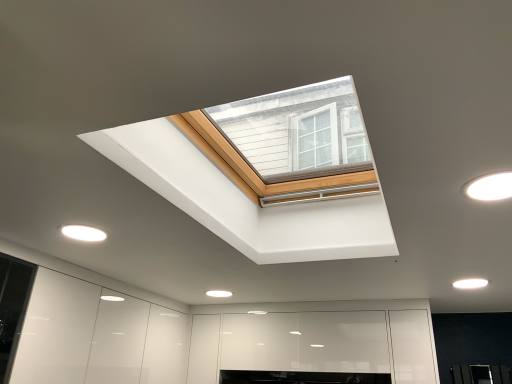
This screenshot has width=512, height=384. What do you see at coordinates (83, 233) in the screenshot? I see `white glossy light fixture at lower left, the 1th lighting when ordered from left to right` at bounding box center [83, 233].

You are a GUI agent. You are given a task and a screenshot of the screen. Output one action in this format:
    pyautogui.click(x=<x>, y=<y>)
    Task: Click on the white matte light fixture at lower right, which ranks as the third lighting in front-to-back order
    
    Given the screenshot: What is the action you would take?
    click(x=470, y=283)

How different are the orientations of white matte light fixture at lower right, arranged as the third lighting when viewed from the left, and white matte light fixture at upper right, which appears as the 3th lighting when viewed from the back, in degrees?

0.000475 degrees separate the facing orientations of white matte light fixture at lower right, arranged as the third lighting when viewed from the left, and white matte light fixture at upper right, which appears as the 3th lighting when viewed from the back.

Are white matte light fixture at lower right, arranged as the third lighting when viewed from the left, and white matte light fixture at upper right, which ranks as the first lighting in front-to-back order, making contact?

There is a gap between white matte light fixture at lower right, arranged as the third lighting when viewed from the left, and white matte light fixture at upper right, which ranks as the first lighting in front-to-back order.

Relative to white matte light fixture at upper right, which ranks as the 3th lighting in bottom-to-top order, is white matte light fixture at lower right, which ranks as the 3th lighting in top-to-bottom order, in front or behind?

white matte light fixture at lower right, which ranks as the 3th lighting in top-to-bottom order, is behind white matte light fixture at upper right, which ranks as the 3th lighting in bottom-to-top order.

In terms of size, does white matte light fixture at lower right, which ranks as the 3th lighting in top-to-bottom order, appear bigger or smaller than white matte light fixture at upper right, the 1th lighting positioned from the top?

In the image, white matte light fixture at lower right, which ranks as the 3th lighting in top-to-bottom order, appears to be smaller than white matte light fixture at upper right, the 1th lighting positioned from the top.

From the image's perspective, which one is positioned higher, white glossy light fixture at lower left, placed as the second lighting when sorted from front to back, or white matte light fixture at upper right, which is the 2th lighting in left-to-right order?

white matte light fixture at upper right, which is the 2th lighting in left-to-right order, appears higher in the image.

Starting from the white glossy light fixture at lower left, positioned as the 3th lighting in right-to-left order, which lighting is the 1st one to the right? Please provide its 2D coordinates.

[(490, 187)]

Based on their positions, is white glossy light fixture at lower left, placed as the second lighting when sorted from front to back, located to the left or right of white matte light fixture at upper right, which appears as the 3th lighting when viewed from the back?

In the image, white glossy light fixture at lower left, placed as the second lighting when sorted from front to back, appears on the left side of white matte light fixture at upper right, which appears as the 3th lighting when viewed from the back.

Is white glossy light fixture at lower left, the 1th lighting when ordered from left to right, beside white matte light fixture at upper right, positioned as the second lighting in right-to-left order?

No, white glossy light fixture at lower left, the 1th lighting when ordered from left to right, is not touching white matte light fixture at upper right, positioned as the second lighting in right-to-left order.

What's the angular difference between white glossy light fixture at lower left, the second lighting positioned from the top, and white matte light fixture at lower right, the 1th lighting when ordered from back to front,'s facing directions?

They differ by 0.000472 degrees in their facing directions.

Which of these two, white glossy light fixture at lower left, the 1th lighting when ordered from left to right, or white matte light fixture at lower right, the first lighting in the bottom-to-top sequence, is thinner?

white matte light fixture at lower right, the first lighting in the bottom-to-top sequence.

From the white glossy light fixture at lower left, marked as the 2th lighting in a back-to-front arrangement, count 2nd lighting to the right and point to it. Please provide its 2D coordinates.

[(470, 283)]

From a real-world perspective, which object rests below the other?

From a 3D spatial view, white glossy light fixture at lower left, positioned as the 3th lighting in right-to-left order, is below.

From the picture: How different are the orientations of white matte light fixture at lower right, which ranks as the 3th lighting in top-to-bottom order, and white glossy light fixture at lower left, arranged as the 2th lighting when ordered from the bottom, in degrees?

0.000472 degrees separate the facing orientations of white matte light fixture at lower right, which ranks as the 3th lighting in top-to-bottom order, and white glossy light fixture at lower left, arranged as the 2th lighting when ordered from the bottom.

Is white matte light fixture at lower right, arranged as the third lighting when viewed from the left, not within white glossy light fixture at lower left, marked as the 2th lighting in a back-to-front arrangement?

Yes, white matte light fixture at lower right, arranged as the third lighting when viewed from the left, is located beyond the bounds of white glossy light fixture at lower left, marked as the 2th lighting in a back-to-front arrangement.

Where is `lighting that is the 1st object located above the white matte light fixture at lower right, which appears as the first lighting when viewed from the right (from the image's perspective)`? This screenshot has width=512, height=384. lighting that is the 1st object located above the white matte light fixture at lower right, which appears as the first lighting when viewed from the right (from the image's perspective) is located at coordinates click(x=83, y=233).

Between white matte light fixture at lower right, the 1th lighting when ordered from back to front, and white glossy light fixture at lower left, marked as the 2th lighting in a back-to-front arrangement, which one has smaller width?

Thinner between the two is white matte light fixture at lower right, the 1th lighting when ordered from back to front.

Between white matte light fixture at upper right, which ranks as the 3th lighting in bottom-to-top order, and white matte light fixture at lower right, which appears as the first lighting when viewed from the right, which one has smaller width?

Thinner between the two is white matte light fixture at lower right, which appears as the first lighting when viewed from the right.

Which lighting is the 1st one when counting from the left side of the white matte light fixture at lower right, arranged as the third lighting when viewed from the left? Please provide its 2D coordinates.

[(490, 187)]

From the image's perspective, is white matte light fixture at upper right, the 1th lighting positioned from the top, under white matte light fixture at lower right, which ranks as the third lighting in front-to-back order?

No.

The image size is (512, 384). There is a white matte light fixture at upper right, which appears as the 3th lighting when viewed from the back. What are the coordinates of `the 1st lighting below it (from the image's perspective)` in the screenshot? It's located at (83, 233).

From the image's perspective, which is above, white matte light fixture at upper right, which ranks as the 3th lighting in bottom-to-top order, or white glossy light fixture at lower left, arranged as the 2th lighting when ordered from the bottom?

white matte light fixture at upper right, which ranks as the 3th lighting in bottom-to-top order, from the image's perspective.

This screenshot has width=512, height=384. Identify the location of the 1st lighting directly beneath the white matte light fixture at upper right, the 1th lighting positioned from the top (from a real-world perspective). (470, 283).

From the image's perspective, count 1st lightings downward from the white matte light fixture at upper right, positioned as the second lighting in right-to-left order, and point to it. Please provide its 2D coordinates.

[(83, 233)]

Looking at the image, which one is located closer to white glossy light fixture at lower left, the 1th lighting when ordered from left to right, white matte light fixture at lower right, arranged as the third lighting when viewed from the left, or white matte light fixture at upper right, which is the 2th lighting in left-to-right order?

white matte light fixture at upper right, which is the 2th lighting in left-to-right order.

Which object lies nearer to the anchor point white matte light fixture at upper right, which ranks as the 3th lighting in bottom-to-top order, white glossy light fixture at lower left, placed as the second lighting when sorted from front to back, or white matte light fixture at lower right, which appears as the first lighting when viewed from the right?

Among the two, white matte light fixture at lower right, which appears as the first lighting when viewed from the right, is located nearer to white matte light fixture at upper right, which ranks as the 3th lighting in bottom-to-top order.

Based on the photo, when comparing their distances from white matte light fixture at lower right, which ranks as the 3th lighting in top-to-bottom order, does white matte light fixture at upper right, which ranks as the 3th lighting in bottom-to-top order, or white glossy light fixture at lower left, marked as the 2th lighting in a back-to-front arrangement, seem further?

Based on the image, white glossy light fixture at lower left, marked as the 2th lighting in a back-to-front arrangement, appears to be further to white matte light fixture at lower right, which ranks as the 3th lighting in top-to-bottom order.

From the image, which object appears to be farther from white matte light fixture at upper right, positioned as the second lighting in right-to-left order, white matte light fixture at lower right, the 1th lighting when ordered from back to front, or white glossy light fixture at lower left, placed as the second lighting when sorted from front to back?

The object further to white matte light fixture at upper right, positioned as the second lighting in right-to-left order, is white glossy light fixture at lower left, placed as the second lighting when sorted from front to back.

Estimate the real-world distances between objects in this image. Which object is further from white glossy light fixture at lower left, positioned as the 3th lighting in right-to-left order, white matte light fixture at upper right, the 1th lighting positioned from the top, or white matte light fixture at lower right, which ranks as the third lighting in front-to-back order?

Based on the image, white matte light fixture at lower right, which ranks as the third lighting in front-to-back order, appears to be further to white glossy light fixture at lower left, positioned as the 3th lighting in right-to-left order.

When comparing their distances from white matte light fixture at lower right, the 1th lighting when ordered from back to front, does white glossy light fixture at lower left, arranged as the 2th lighting when ordered from the bottom, or white matte light fixture at upper right, which is the 2th lighting in left-to-right order, seem further?

white glossy light fixture at lower left, arranged as the 2th lighting when ordered from the bottom, is positioned further to the anchor white matte light fixture at lower right, the 1th lighting when ordered from back to front.

Find the location of `lighting located between white glossy light fixture at lower left, positioned as the 3th lighting in right-to-left order, and white matte light fixture at lower right, which ranks as the third lighting in front-to-back order, in the left-right direction`. lighting located between white glossy light fixture at lower left, positioned as the 3th lighting in right-to-left order, and white matte light fixture at lower right, which ranks as the third lighting in front-to-back order, in the left-right direction is located at coordinates (490, 187).